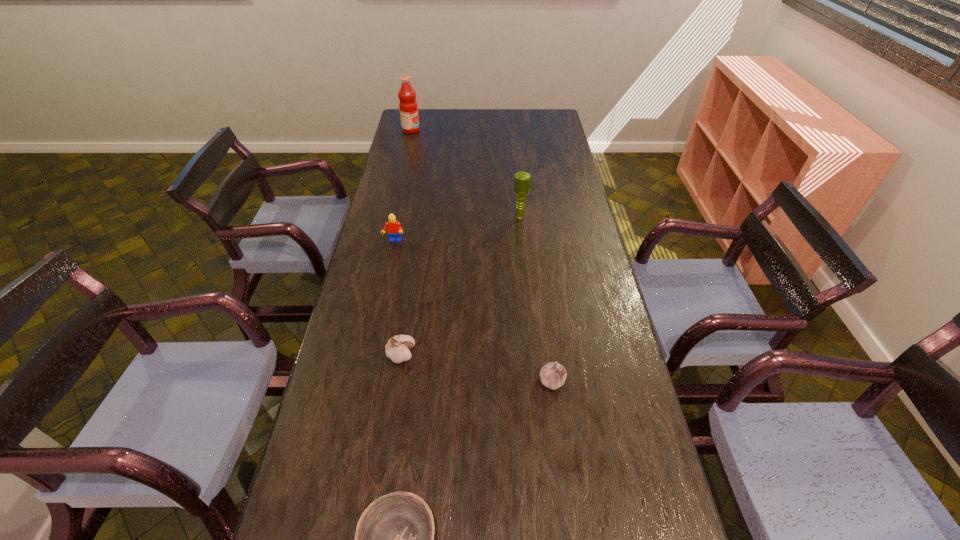
At what (x,y) coordinates should I click in order to perform the action: click on vacant space located 0.380m on the back of the second tallest object. Please return your answer as a coordinate pair (x, y). This screenshot has height=540, width=960. Looking at the image, I should click on pyautogui.click(x=514, y=162).

Image resolution: width=960 pixels, height=540 pixels. What are the coordinates of `free space located on the front-facing side of the Lego` in the screenshot? It's located at (378, 315).

Find the location of a particular element. free space located on the back of the left garlic is located at coordinates (409, 305).

The image size is (960, 540). I want to click on vacant position located on the left of the nearer garlic, so coord(428,381).

Image resolution: width=960 pixels, height=540 pixels. Identify the location of object at the far edge. (408, 107).

Identify the location of fruit juice that is at the left edge. The height and width of the screenshot is (540, 960). (408, 107).

Locate an element on the screen. This screenshot has width=960, height=540. Lego that is positioned at the left edge is located at coordinates (394, 229).

I want to click on garlic located at the left edge, so click(397, 349).

You are a GUI agent. You are given a task and a screenshot of the screen. Output one action in this format:
    pyautogui.click(x=<x>, y=<y>)
    Task: Click on the object that is positioned at the far left corner
    The image size is (960, 540).
    Given the screenshot: What is the action you would take?
    pyautogui.click(x=408, y=107)

Where is `vacant region at the far edge of the desktop`? This screenshot has height=540, width=960. vacant region at the far edge of the desktop is located at coordinates (444, 116).